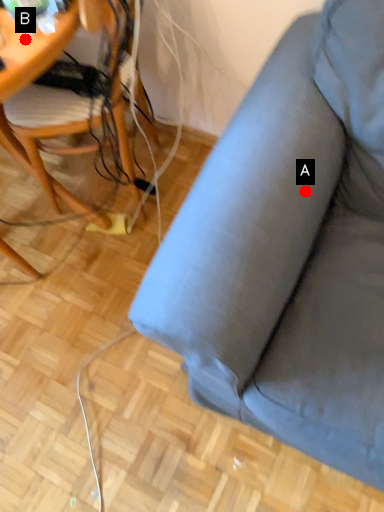
Question: Two points are circled on the image, labeled by A and B beside each circle. Which of the following is the farthest from the observer?

Choices:
 (A) A is further
 (B) B is further

Answer: (B)